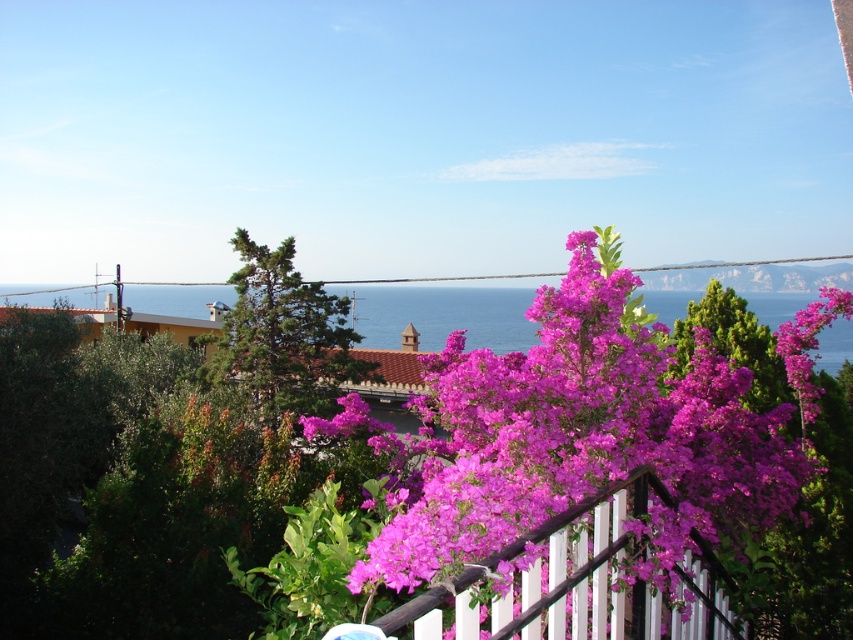
Which is above, purple matte flowers at center or wooden fence at center?

purple matte flowers at center

Is purple matte flowers at center to the right of wooden fence at center from the viewer's perspective?

Incorrect, purple matte flowers at center is not on the right side of wooden fence at center.

This screenshot has width=853, height=640. Describe the element at coordinates (581, 435) in the screenshot. I see `purple matte flowers at center` at that location.

What are the coordinates of `purple matte flowers at center` in the screenshot? It's located at (581, 435).